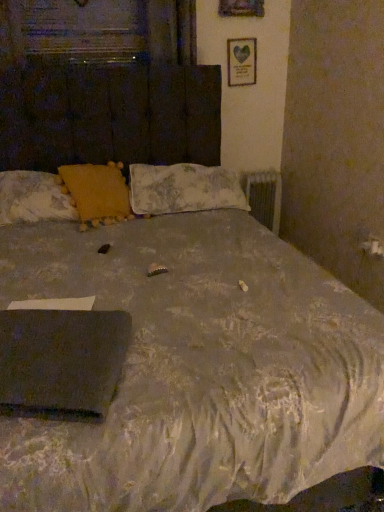
Question: From their relative heights in the image, would you say metallic silver radiator at right is taller or shorter than yellow fabric pillow at upper left, positioned as the first pillow in left-to-right order?

Choices:
 (A) short
 (B) tall

Answer: (B)

Question: From a real-world perspective, relative to yellow fabric pillow at upper left, the 3th pillow in the right-to-left sequence, is metallic silver radiator at right vertically above or below?

Choices:
 (A) above
 (B) below

Answer: (B)

Question: Which object is positioned farthest from the black matte laptop at lower left?

Choices:
 (A) yellow fabric pillow at upper center, the second pillow when ordered from left to right
 (B) yellow fabric pillow at upper left, positioned as the first pillow in left-to-right order
 (C) white paper at upper center
 (D) fluffy fabric pillow at center, the first pillow viewed from the right
 (E) metallic silver radiator at right

Answer: (C)

Question: Based on their relative distances, which object is nearer to the white paper at upper center?

Choices:
 (A) yellow fabric pillow at upper left, the 3th pillow in the right-to-left sequence
 (B) fluffy fabric pillow at center, the 3th pillow in the left-to-right sequence
 (C) yellow fabric pillow at upper center, the second pillow when ordered from left to right
 (D) black matte laptop at lower left
 (E) metallic silver radiator at right

Answer: (E)